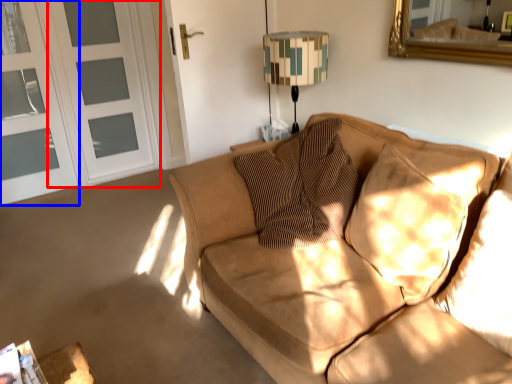
Question: Which point is further to the camera, screen door (highlighted by a red box) or screen door (highlighted by a blue box)?

Choices:
 (A) screen door
 (B) screen door

Answer: (A)